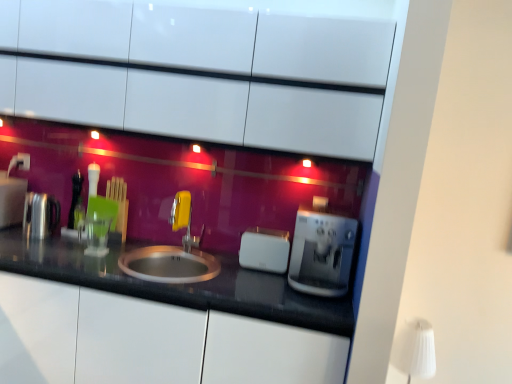
Where is `satin silver coffee machine at center`? Image resolution: width=512 pixels, height=384 pixels. satin silver coffee machine at center is located at coordinates (322, 253).

Describe the element at coordinates (322, 253) in the screenshot. The height and width of the screenshot is (384, 512). I see `satin silver coffee machine at center` at that location.

The image size is (512, 384). What do you see at coordinates (169, 264) in the screenshot?
I see `satin silver sink at center` at bounding box center [169, 264].

The height and width of the screenshot is (384, 512). Describe the element at coordinates (264, 250) in the screenshot. I see `white plastic toaster at center, which ranks as the first appliance in right-to-left order` at that location.

This screenshot has height=384, width=512. I want to click on white plastic toaster at center, which ranks as the second appliance in left-to-right order, so click(x=264, y=250).

What do you see at coordinates (415, 349) in the screenshot? The image size is (512, 384). I see `white fabric lampshade at upper right` at bounding box center [415, 349].

Describe the element at coordinates (178, 284) in the screenshot. I see `black granite countertop at center` at that location.

The height and width of the screenshot is (384, 512). Identify the location of satin silver coffee machine at center. (322, 253).

How much distance is there between white fabric lampshade at upper right and satin silver sink at center?

A distance of 1.13 meters exists between white fabric lampshade at upper right and satin silver sink at center.

Considering the positions of points (419, 347) and (155, 248), is point (419, 347) farther from camera compared to point (155, 248)?

No, it is not.

In the scene shown: Is white fabric lampshade at upper right thinner than satin silver sink at center?

Correct, the width of white fabric lampshade at upper right is less than that of satin silver sink at center.

From a real-world perspective, is white fabric lampshade at upper right over satin silver sink at center?

Incorrect, from a real-world perspective, white fabric lampshade at upper right is lower than satin silver sink at center.

How many degrees apart are the facing directions of black granite countertop at center and white plastic electric outlet at upper left?

The angle between the facing direction of black granite countertop at center and the facing direction of white plastic electric outlet at upper left is 5.35 degrees.

Considering the sizes of objects black granite countertop at center and white plastic electric outlet at upper left in the image provided, who is smaller, black granite countertop at center or white plastic electric outlet at upper left?

With smaller size is white plastic electric outlet at upper left.

Is point (219, 300) closer or farther from the camera than point (20, 163)?

Clearly, point (219, 300) is closer to the camera than point (20, 163).

Is black granite countertop at center far from white plastic electric outlet at upper left?

Yes, black granite countertop at center is far from white plastic electric outlet at upper left.

Would you say satin silver sink at center is a long distance from satin silver coffee machine at center?

They are positioned close to each other.

Which is correct: satin silver sink at center is inside satin silver coffee machine at center, or outside of it?

satin silver sink at center is spatially situated outside satin silver coffee machine at center.

Is satin silver sink at center looking in the opposite direction of satin silver coffee machine at center?

No, satin silver sink at center's orientation is not away from satin silver coffee machine at center.

Which is correct: black granite countertop at center is inside white fabric lampshade at upper right, or outside of it?

black granite countertop at center is spatially situated outside white fabric lampshade at upper right.

Is black granite countertop at center in contact with white fabric lampshade at upper right?

No, black granite countertop at center is not with white fabric lampshade at upper right.

Does black granite countertop at center have a larger size compared to white fabric lampshade at upper right?

Indeed, black granite countertop at center has a larger size compared to white fabric lampshade at upper right.

Consider the image. Is white plastic electric outlet at upper left taller than white fabric lampshade at upper right?

In fact, white plastic electric outlet at upper left may be shorter than white fabric lampshade at upper right.

Which is nearer, (19, 164) or (408, 322)?

The point (408, 322) is closer.

Measure the distance from white plastic electric outlet at upper left to white fabric lampshade at upper right.

white plastic electric outlet at upper left and white fabric lampshade at upper right are 2.34 meters apart.

Is white glossy cabinets at upper center positioned behind white fabric lampshade at upper right?

No, white glossy cabinets at upper center is in front of white fabric lampshade at upper right.

Is white glossy cabinets at upper center taller than white fabric lampshade at upper right?

Yes, white glossy cabinets at upper center is taller than white fabric lampshade at upper right.

From a real-world perspective, is white glossy cabinets at upper center physically located above or below white fabric lampshade at upper right?

Clearly, from a real-world perspective, white glossy cabinets at upper center is above white fabric lampshade at upper right.

Considering the positions of points (298, 63) and (412, 341), is point (298, 63) closer to camera compared to point (412, 341)?

Yes.

From a real-world perspective, between yellow plastic faucet at center and satin silver coffee machine at center, who is vertically lower?

yellow plastic faucet at center.

Between yellow plastic faucet at center and satin silver coffee machine at center, which one appears on the left side from the viewer's perspective?

yellow plastic faucet at center.

Is yellow plastic faucet at center looking in the opposite direction of satin silver coffee machine at center?

No.

Which is correct: yellow plastic faucet at center is inside satin silver coffee machine at center, or outside of it?

yellow plastic faucet at center exists outside the volume of satin silver coffee machine at center.

Locate an element on the screen. This screenshot has height=384, width=512. sink to the left of white fabric lampshade at upper right is located at coordinates (169, 264).

Where is `electric outlet above the black granite countertop at center (from a real-world perspective)`? The width and height of the screenshot is (512, 384). electric outlet above the black granite countertop at center (from a real-world perspective) is located at coordinates (23, 161).

Looking at the image, which one is located further to white glossy cabinets at upper center, satin silver coffee machine at center or white plastic electric outlet at upper left?

white plastic electric outlet at upper left lies further to white glossy cabinets at upper center than the other object.

Estimate the real-world distances between objects in this image. Which object is closer to satin silver coffee machine at center, black granite countertop at center or yellow plastic faucet at center?

Among the two, black granite countertop at center is located nearer to satin silver coffee machine at center.

Based on their spatial positions, is satin silver coffee machine at center or polished stainless steel kettle at left, positioned as the second appliance in right-to-left order, closer to white glossy cabinets at upper center?

satin silver coffee machine at center.

When comparing their distances from white fabric lampshade at upper right, does yellow plastic faucet at center or satin silver coffee machine at center seem closer?

Among the two, satin silver coffee machine at center is located nearer to white fabric lampshade at upper right.

Looking at the image, which one is located closer to yellow plastic faucet at center, white plastic electric outlet at upper left or white glossy cabinets at upper center?

The object closer to yellow plastic faucet at center is white glossy cabinets at upper center.

Which object lies nearer to the anchor point white fabric lampshade at upper right, black granite countertop at center or white plastic toaster at center, which ranks as the second appliance in left-to-right order?

white plastic toaster at center, which ranks as the second appliance in left-to-right order.

Based on the photo, from the image, which object appears to be farther from black granite countertop at center, white glossy cabinets at upper center or white plastic electric outlet at upper left?

Based on the image, white plastic electric outlet at upper left appears to be further to black granite countertop at center.

Estimate the real-world distances between objects in this image. Which object is closer to satin silver coffee machine at center, polished stainless steel kettle at left, positioned as the 1th appliance in left-to-right order, or satin silver sink at center?

Based on the image, satin silver sink at center appears to be nearer to satin silver coffee machine at center.

The height and width of the screenshot is (384, 512). I want to click on countertop between white plastic electric outlet at upper left and yellow plastic faucet at center in the horizontal direction, so click(x=178, y=284).

The image size is (512, 384). I want to click on cabinetry between polished stainless steel kettle at left, positioned as the second appliance in right-to-left order, and satin silver coffee machine at center from left to right, so click(214, 38).

In order to click on appliance between white plastic electric outlet at upper left and satin silver sink at center in the horizontal direction in this screenshot , I will do `click(40, 215)`.

Where is `countertop situated between polished stainless steel kettle at left, positioned as the 1th appliance in left-to-right order, and yellow plastic faucet at center from left to right`? countertop situated between polished stainless steel kettle at left, positioned as the 1th appliance in left-to-right order, and yellow plastic faucet at center from left to right is located at coordinates (178, 284).